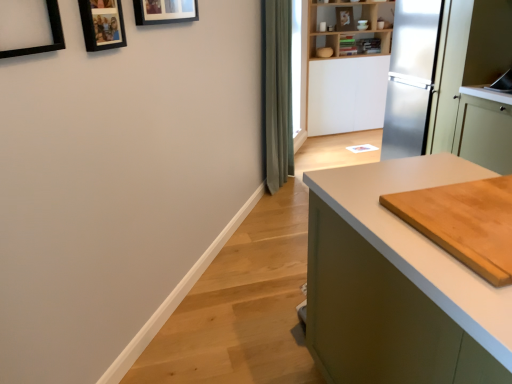
Question: Can you confirm if green fabric curtain at center is taller than light brown wooden cutting board at right?

Choices:
 (A) yes
 (B) no

Answer: (A)

Question: Does green fabric curtain at center have a lesser height compared to light brown wooden cutting board at right?

Choices:
 (A) yes
 (B) no

Answer: (B)

Question: Is the depth of green fabric curtain at center greater than that of light brown wooden cutting board at right?

Choices:
 (A) no
 (B) yes

Answer: (B)

Question: Is green fabric curtain at center turned away from light brown wooden cutting board at right?

Choices:
 (A) yes
 (B) no

Answer: (B)

Question: From a real-world perspective, does green fabric curtain at center sit lower than light brown wooden cutting board at right?

Choices:
 (A) yes
 (B) no

Answer: (A)

Question: From a real-world perspective, does green fabric curtain at center stand above light brown wooden cutting board at right?

Choices:
 (A) yes
 (B) no

Answer: (B)

Question: Does wooden photo frame at upper left, positioned as the 2th picture frame in front-to-back order, have a greater height compared to wooden picture frame at upper center, acting as the first picture frame starting from the back?

Choices:
 (A) yes
 (B) no

Answer: (A)

Question: From the image's perspective, is wooden photo frame at upper left, which appears as the 2th picture frame when viewed from the left, on top of wooden picture frame at upper center, acting as the third picture frame starting from the front?

Choices:
 (A) yes
 (B) no

Answer: (B)

Question: Is wooden photo frame at upper left, which appears as the 2th picture frame when viewed from the left, closer to camera compared to wooden picture frame at upper center, the third picture frame positioned from the left?

Choices:
 (A) no
 (B) yes

Answer: (B)

Question: Is wooden photo frame at upper left, which appears as the 2th picture frame when viewed from the left, not near wooden picture frame at upper center, acting as the first picture frame starting from the back?

Choices:
 (A) no
 (B) yes

Answer: (A)

Question: Is wooden photo frame at upper left, acting as the second picture frame starting from the back, positioned with its back to wooden picture frame at upper center, which is the first picture frame from right to left?

Choices:
 (A) yes
 (B) no

Answer: (B)

Question: Is the depth of wooden photo frame at upper left, acting as the second picture frame starting from the back, greater than that of wooden picture frame at upper center, the third picture frame positioned from the left?

Choices:
 (A) yes
 (B) no

Answer: (B)

Question: Considering the relative sizes of light brown wooden cutting board at right and wooden photo frame at upper left, positioned as the 2th picture frame in front-to-back order, in the image provided, is light brown wooden cutting board at right taller than wooden photo frame at upper left, positioned as the 2th picture frame in front-to-back order,?

Choices:
 (A) no
 (B) yes

Answer: (A)